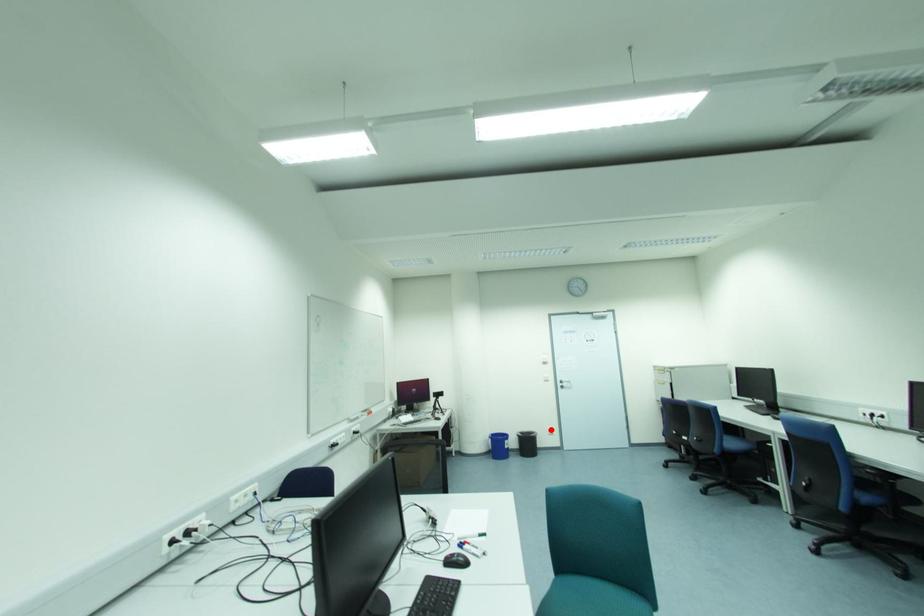
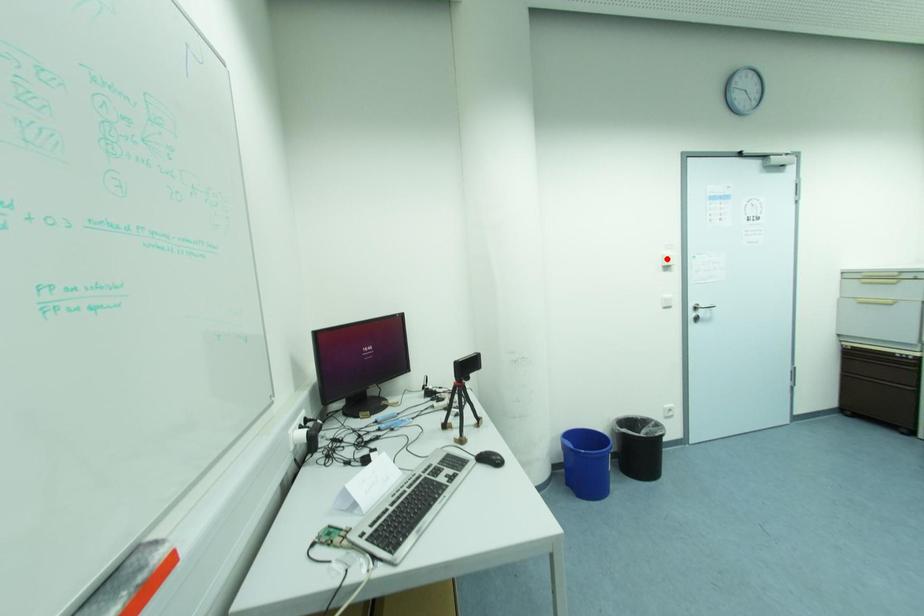
I am providing you with two images of the same scene from different viewpoints. A red point is marked on the first image and another point is marked on the second image. Is the red point in image1 aligned with the point shown in image2?

No